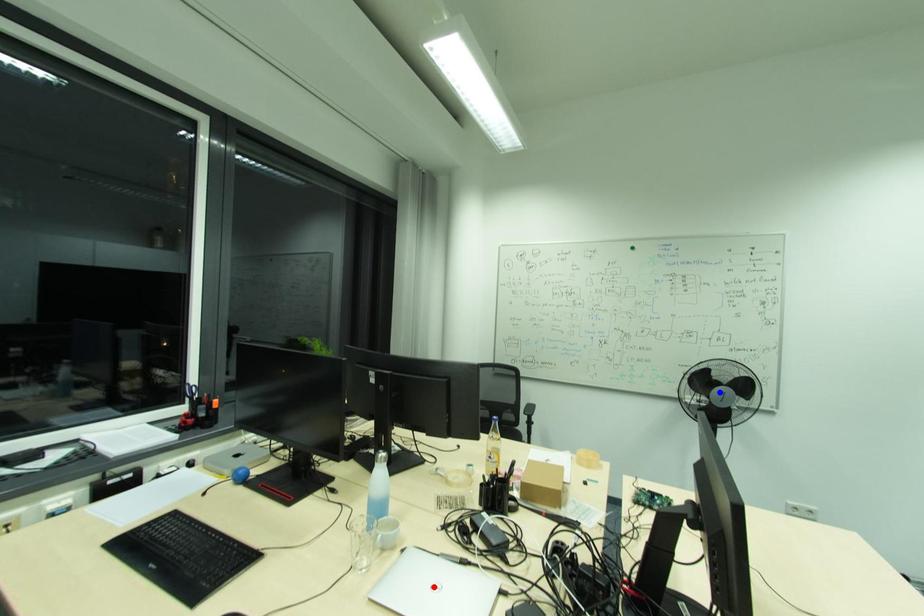
Question: Two points are marked on the image. Which point is closer to the camera?

Choices:
 (A) Blue point is closer.
 (B) Red point is closer.

Answer: (B)